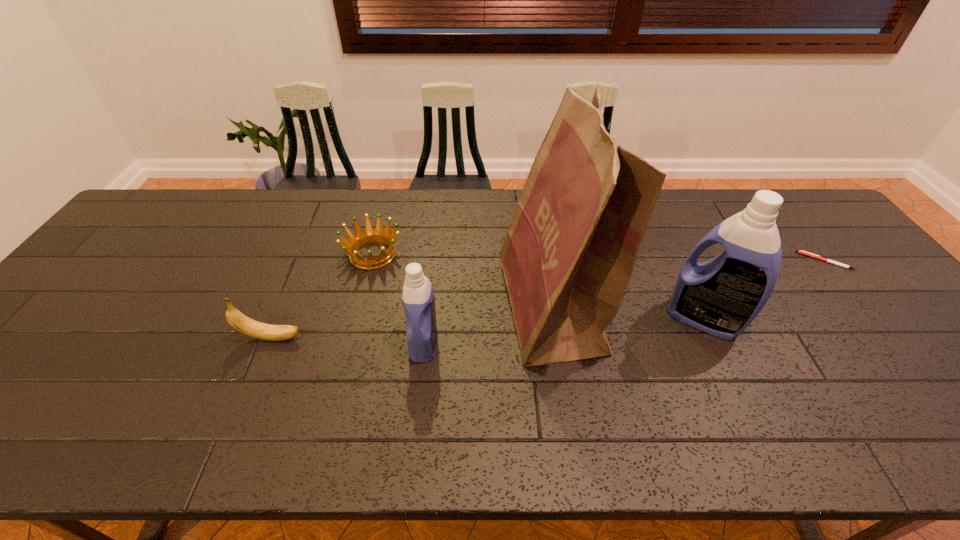
This screenshot has height=540, width=960. I want to click on vacant space located 0.230m on the front-facing side of the tallest object, so click(413, 308).

At what (x,y) coordinates should I click in order to perform the action: click on vacant space situated on the front-facing side of the tallest object. Please return your answer as a coordinate pair (x, y). Looking at the image, I should click on (413, 308).

Locate an element on the screen. The width and height of the screenshot is (960, 540). object located at the right edge is located at coordinates (800, 252).

Find the location of `free space at the far edge of the desktop`. free space at the far edge of the desktop is located at coordinates tap(348, 194).

Where is `vacant space at the near edge of the desktop`? The image size is (960, 540). vacant space at the near edge of the desktop is located at coordinates (224, 407).

In the image, there is a desktop. Where is `vacant area at the left edge`? The image size is (960, 540). vacant area at the left edge is located at coordinates (128, 281).

Image resolution: width=960 pixels, height=540 pixels. I want to click on free space at the right edge of the desktop, so click(x=884, y=316).

Identify the location of free space at the far right corner of the desktop. (825, 222).

Where is `free space at the near right corner of the desktop`? free space at the near right corner of the desktop is located at coordinates (933, 403).

You are a GUI agent. You are given a task and a screenshot of the screen. Output one action in this format:
    pyautogui.click(x=<x>, y=<y>)
    Task: Click on the free space between the left detergent and the banana
    
    Given the screenshot: What is the action you would take?
    [348, 340]